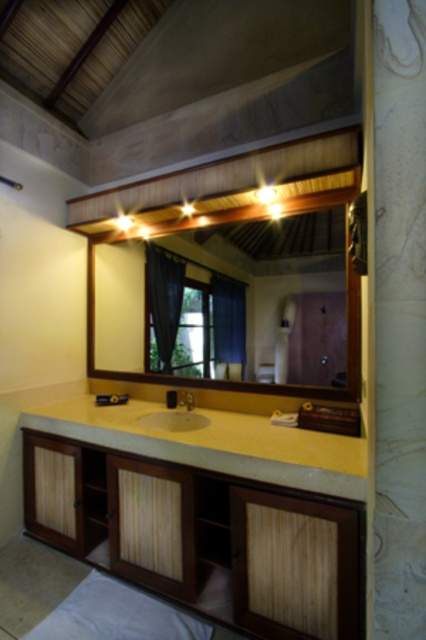
Describe the element at coordinates (216, 444) in the screenshot. I see `yellow laminate sink at center` at that location.

Does yellow laminate sink at center appear over white glossy sink at center?

Indeed, yellow laminate sink at center is positioned over white glossy sink at center.

Locate an element on the screen. yellow laminate sink at center is located at coordinates (216, 444).

This screenshot has height=640, width=426. I want to click on yellow laminate sink at center, so click(x=216, y=444).

Who is more distant from viewer, (230, 349) or (157, 412)?

The point (157, 412) is behind.

Can you confirm if dark blue fabric curtain at center is thinner than white glossy sink at center?

Yes, dark blue fabric curtain at center is thinner than white glossy sink at center.

The width and height of the screenshot is (426, 640). What are the coordinates of `dark blue fabric curtain at center` in the screenshot? It's located at (229, 321).

Can you confirm if wooden cabinet at lower center is wider than wooden frame mirror at upper center?

Yes, wooden cabinet at lower center is wider than wooden frame mirror at upper center.

Is wooden cabinet at lower center above wooden frame mirror at upper center?

No.

Measure the distance between point (28, 440) and camera.

8.58 feet

Image resolution: width=426 pixels, height=640 pixels. Find the location of `wooden cabinet at lower center`. wooden cabinet at lower center is located at coordinates (207, 513).